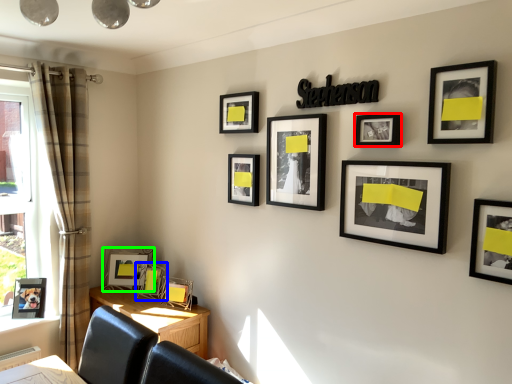
Question: Which is nearer to the picture frame (highlighted by a red box)? picture frame (highlighted by a blue box) or picture frame (highlighted by a green box).

Choices:
 (A) picture frame
 (B) picture frame

Answer: (A)